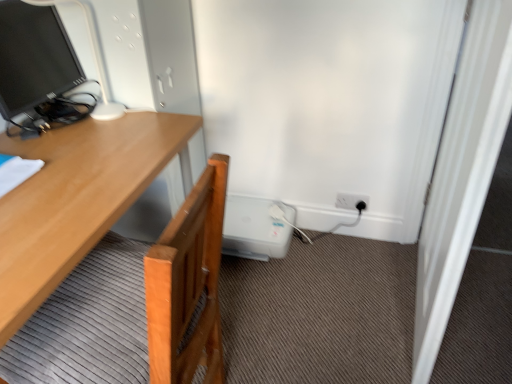
Find the location of a particular element. vacant space in front of matte black monitor at upper left is located at coordinates (67, 163).